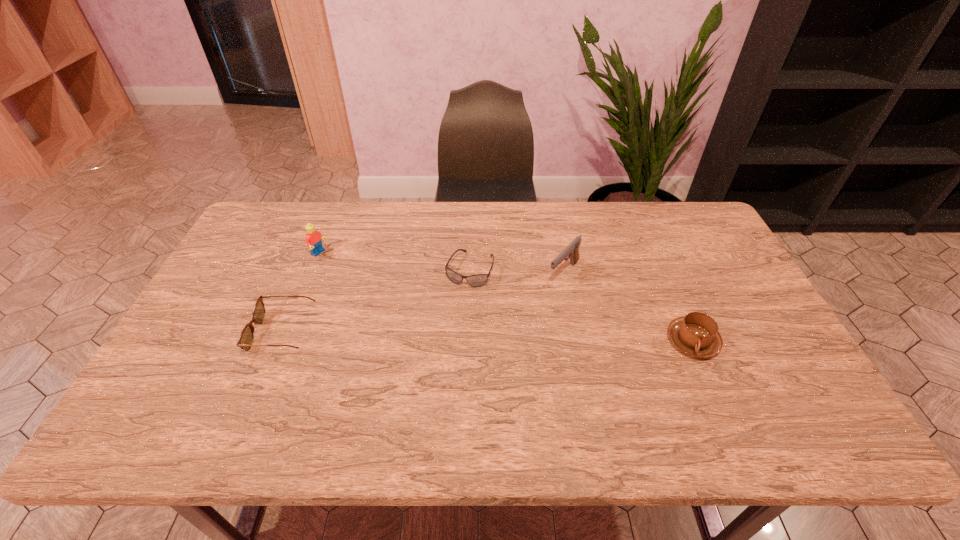
Where is `free space between the rightmost object and the third object from left to right`? The width and height of the screenshot is (960, 540). free space between the rightmost object and the third object from left to right is located at coordinates (581, 305).

Image resolution: width=960 pixels, height=540 pixels. Find the location of `vacant area that lies between the spectacles and the shortest object`. vacant area that lies between the spectacles and the shortest object is located at coordinates (377, 301).

Find the location of a particular element. Image resolution: width=960 pixels, height=540 pixels. free space between the Lego and the spectacles is located at coordinates (301, 293).

In order to click on object that is the closest to the shortest object in this screenshot , I will do `click(571, 251)`.

Select which object appears as the fourth closest to the Lego. Please provide its 2D coordinates. Your answer should be formatted as a tuple, i.e. [(x, y)], where the tuple contains the x and y coordinates of a point satisfying the conditions above.

[(696, 334)]